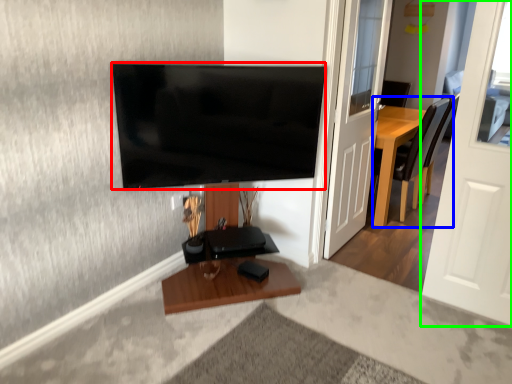
Question: Based on their relative distances, which object is farther from television (highlighted by a red box)? Choose from chair (highlighted by a blue box) and door (highlighted by a green box).

Choices:
 (A) chair
 (B) door

Answer: (A)